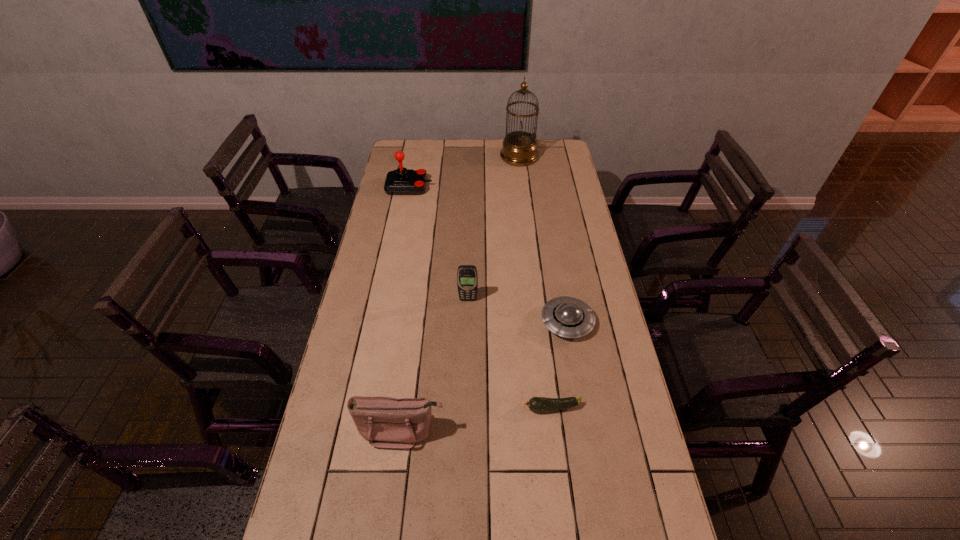
Find the location of `blank space located 0.050m with an open door on the tallest object`. blank space located 0.050m with an open door on the tallest object is located at coordinates (490, 157).

At what (x,y) coordinates should I click in order to perform the action: click on free space located 0.380m with an open door on the tallest object. Please return your answer as a coordinate pair (x, y). The image size is (960, 540). Looking at the image, I should click on (424, 157).

The height and width of the screenshot is (540, 960). I want to click on free space located 0.190m on the base of the joystick, so click(x=473, y=187).

Locate an element on the screen. The width and height of the screenshot is (960, 540). free space located on the screen of the fourth object from right to left is located at coordinates (467, 367).

Identify the location of free location located on the front pocket of the shoulder bag. This screenshot has height=540, width=960. (396, 478).

Locate an element on the screen. This screenshot has width=960, height=540. free space located 0.370m on the back of the saucer is located at coordinates (552, 234).

You are a GUI agent. You are given a task and a screenshot of the screen. Output one action in this format:
    pyautogui.click(x=<x>, y=<y>)
    Task: Click on the free space located at the blossom end of the shortest object
    
    Given the screenshot: What is the action you would take?
    pyautogui.click(x=420, y=408)

The image size is (960, 540). Find the location of `vacant region located at the blossom end of the shortest object`. vacant region located at the blossom end of the shortest object is located at coordinates (468, 408).

The image size is (960, 540). Find the location of `free space located at the blossom end of the shortest object`. free space located at the blossom end of the shortest object is located at coordinates (489, 408).

What are the coordinates of `object located at the far edge` in the screenshot? It's located at (519, 148).